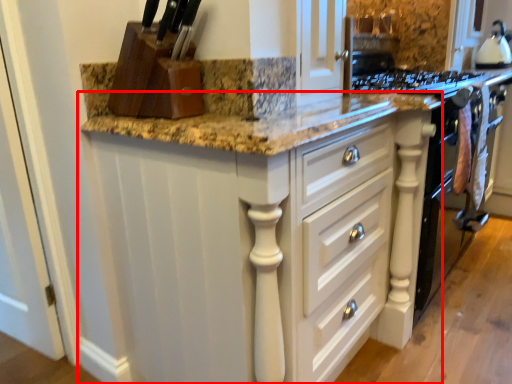
Question: From the image's perspective, where is cabinetry (annotated by the red box) located relative to kitchen appliance?

Choices:
 (A) above
 (B) below

Answer: (B)